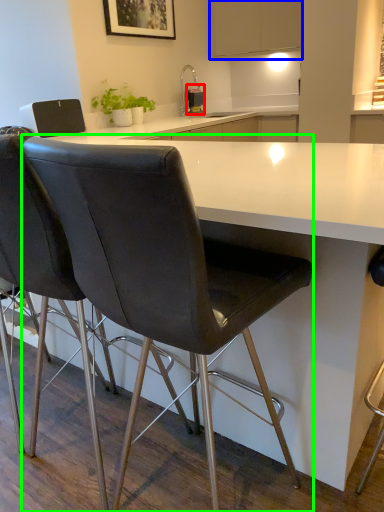
Question: Which object is the farthest from kitchen appliance (highlighted by a red box)? Choose among these: cabinetry (highlighted by a blue box) or chair (highlighted by a green box).

Choices:
 (A) cabinetry
 (B) chair

Answer: (B)